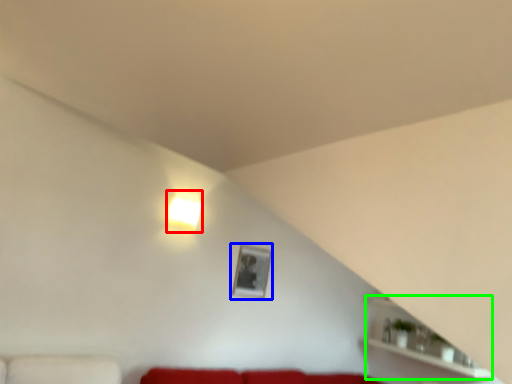
Question: Estimate the real-world distances between objects in this image. Which object is farther from lamp (highlighted by a red box), picture frame (highlighted by a blue box) or shelf (highlighted by a green box)?

Choices:
 (A) picture frame
 (B) shelf

Answer: (B)